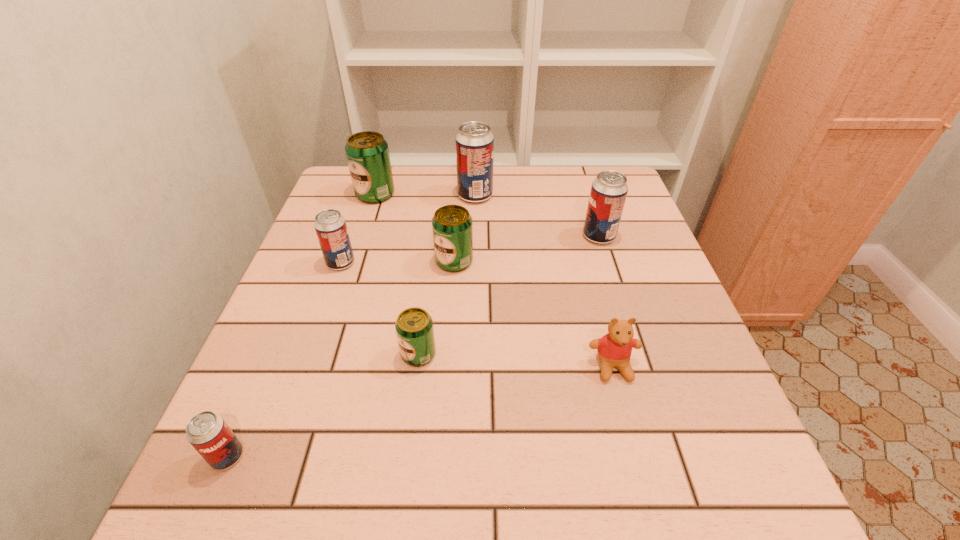
You are a GUI agent. You are given a task and a screenshot of the screen. Output one action in this format:
    pyautogui.click(x=<x>, y=<y>)
    Task: Click on the farthest red beer can
    The height and width of the screenshot is (540, 960).
    Given the screenshot: What is the action you would take?
    pyautogui.click(x=474, y=142)

This screenshot has height=540, width=960. Identify the location of the tallest beer can. (474, 142).

The height and width of the screenshot is (540, 960). I want to click on the leftmost green beer can, so click(x=367, y=152).

You are a GUI agent. You are given a task and a screenshot of the screen. Output one action in this format:
    pyautogui.click(x=<x>, y=<y>)
    Task: Click on the farthest green beer can
    The height and width of the screenshot is (540, 960).
    Given the screenshot: What is the action you would take?
    pyautogui.click(x=367, y=152)

Locate an element on the screen. Image resolution: width=960 pixels, height=540 pixels. the fifth nearest beer can is located at coordinates (609, 190).

Identify the location of the rightmost beer can. This screenshot has height=540, width=960. (609, 190).

Where is `the third farthest red beer can`? the third farthest red beer can is located at coordinates (330, 226).

I want to click on the second smallest red beer can, so click(x=330, y=226).

Where is `the second smallest green beer can`? This screenshot has width=960, height=540. the second smallest green beer can is located at coordinates (452, 227).

Locate an element on the screen. The height and width of the screenshot is (540, 960). red teddy bear is located at coordinates (614, 349).